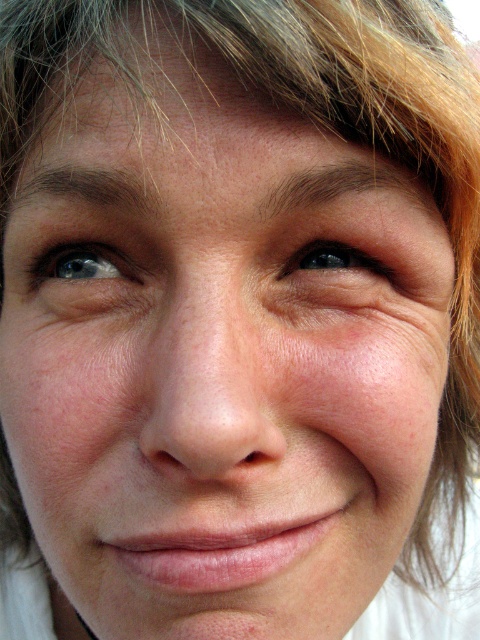
Question: Considering the relative positions of blue glossy eye at upper left and black glossy eye at upper center in the image provided, where is blue glossy eye at upper left located with respect to black glossy eye at upper center?

Choices:
 (A) below
 (B) above

Answer: (B)

Question: Is blue glossy eye at upper left thinner than black glossy eye at upper center?

Choices:
 (A) yes
 (B) no

Answer: (B)

Question: Among these objects, which one is farthest from the camera?

Choices:
 (A) blue glossy eye at upper left
 (B) black glossy eye at upper center

Answer: (A)

Question: Does blue glossy eye at upper left appear over black glossy eye at upper center?

Choices:
 (A) no
 (B) yes

Answer: (B)